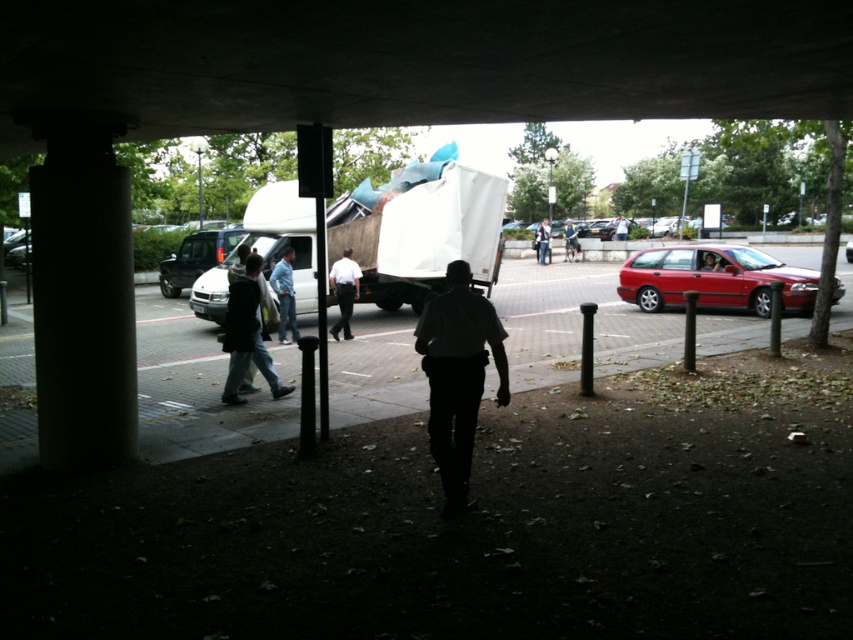
Question: Among these points, which one is farthest from the camera?

Choices:
 (A) (241, 368)
 (B) (572, 248)

Answer: (B)

Question: Which of these objects is positioned closest to the concrete ceiling at upper center?

Choices:
 (A) light brown leather jacket at center
 (B) concrete pavement at center
 (C) light blue jeans at center
 (D) blue jeans at center

Answer: (D)

Question: Where is concrete pavement at center located in relation to dark gray fabric jacket at center in the image?

Choices:
 (A) right
 (B) left

Answer: (A)

Question: In this image, where is matte red station wagon at right located relative to blue jeans at center?

Choices:
 (A) below
 (B) above

Answer: (B)

Question: Is dark gray fabric jacket at center below blue jeans at center?

Choices:
 (A) yes
 (B) no

Answer: (A)

Question: Which point is farther to the camera?

Choices:
 (A) dark gray fabric jacket at center
 (B) blue jeans at center
 (C) white shirt at center
 (D) concrete pavement at center

Answer: (C)